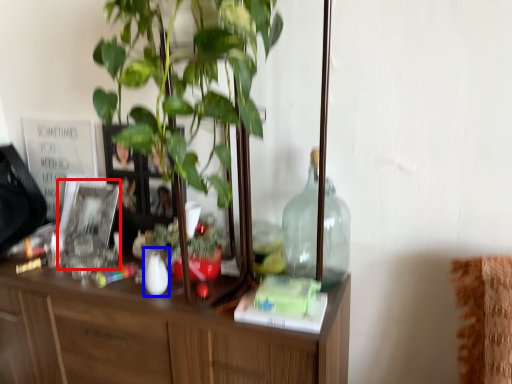
Question: Which of the following is the farthest to the observer, picture frame (highlighted by a red box) or vase (highlighted by a blue box)?

Choices:
 (A) picture frame
 (B) vase

Answer: (A)